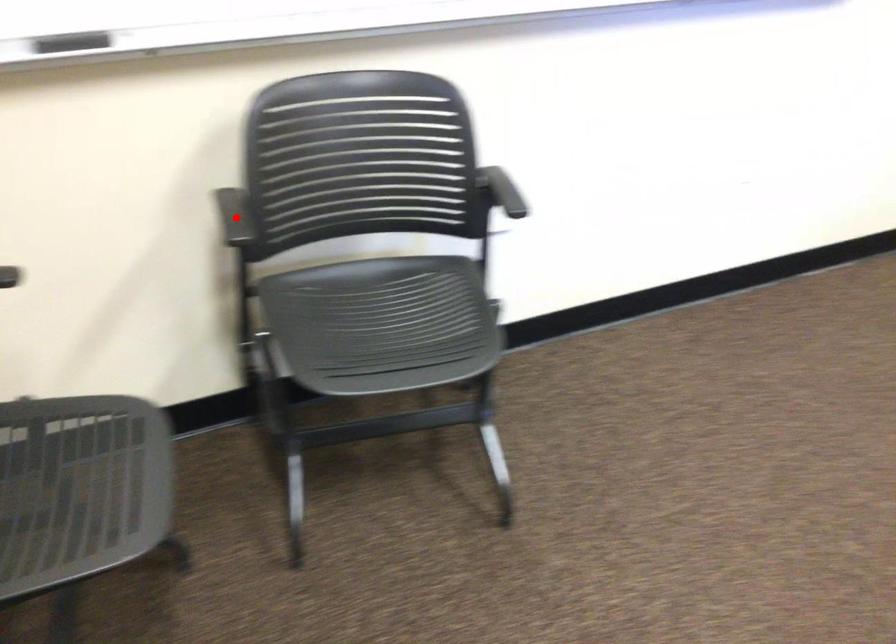
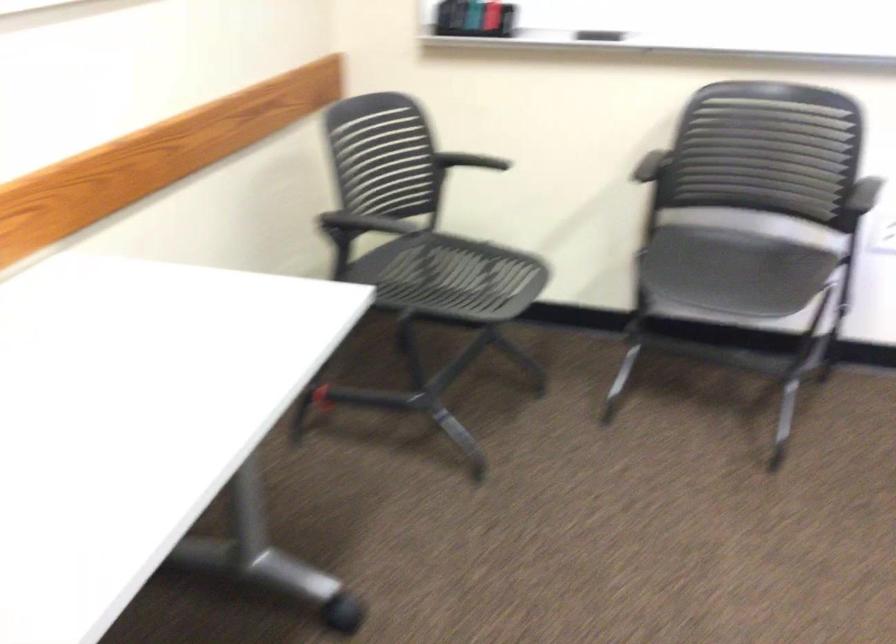
The point at the highlighted location is marked in the first image. Where is the corresponding point in the second image?

(649, 166)